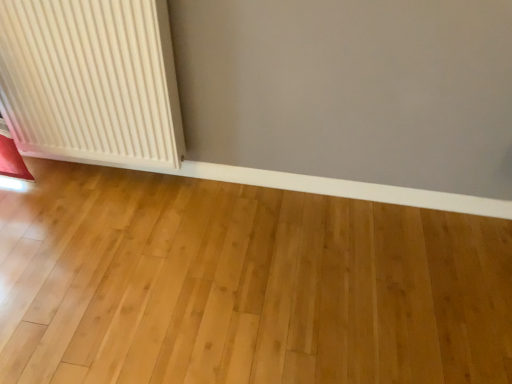
What do you see at coordinates (91, 80) in the screenshot? I see `white matte radiator at left` at bounding box center [91, 80].

Locate an element on the screen. This screenshot has width=512, height=384. white matte radiator at left is located at coordinates (91, 80).

What are the coordinates of `white matte radiator at left` in the screenshot? It's located at (91, 80).